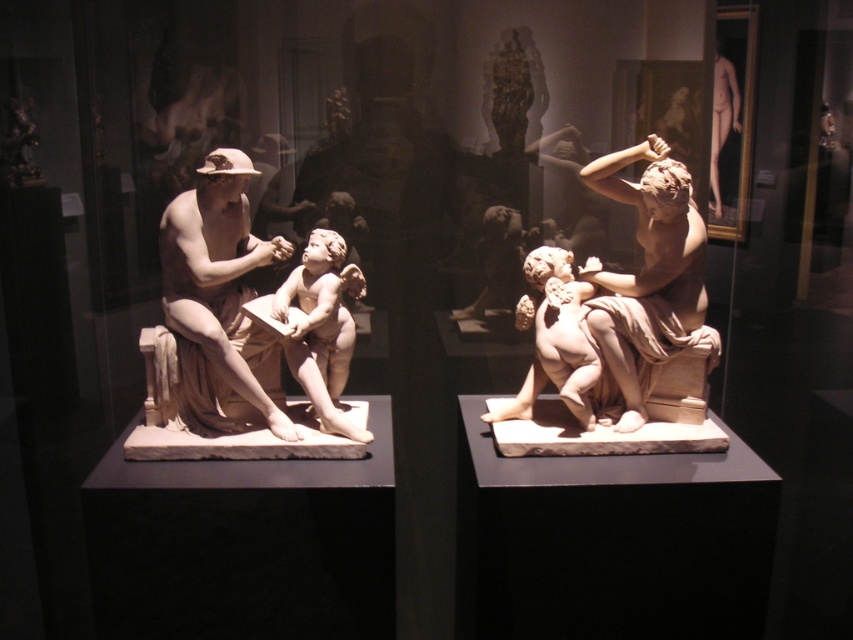
Measure the distance between point (167, 308) and camera.

Point (167, 308) and camera are 2.65 meters apart.

Does matte stone man at left have a lesser height compared to matte beige statue at right?

Yes.

Who is more distant from viewer, (x=265, y=412) or (x=636, y=150)?

Point (x=265, y=412)

At what (x,y) coordinates should I click in order to perform the action: click on matte stone man at left. Please return your answer as a coordinate pair (x, y). The height and width of the screenshot is (640, 853). Looking at the image, I should click on (218, 294).